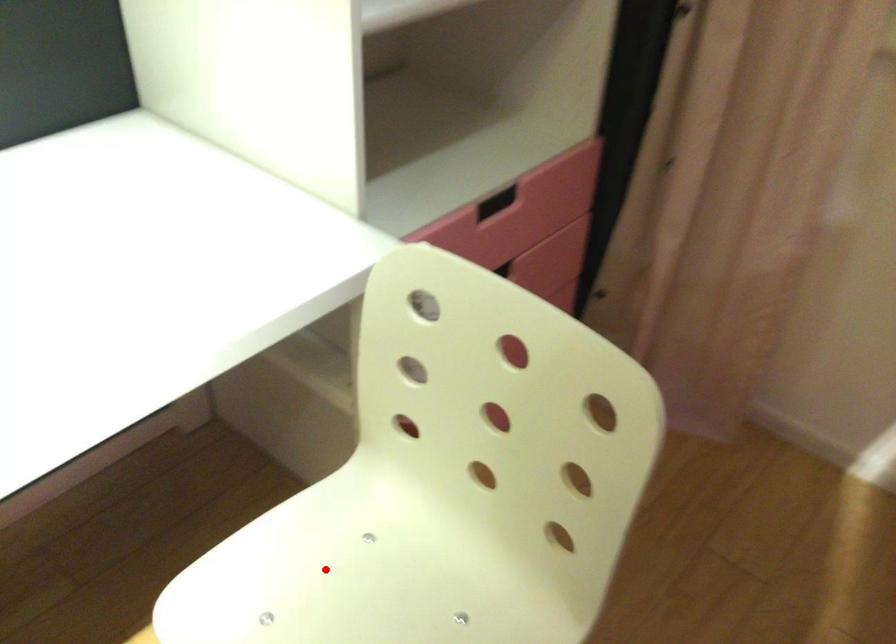
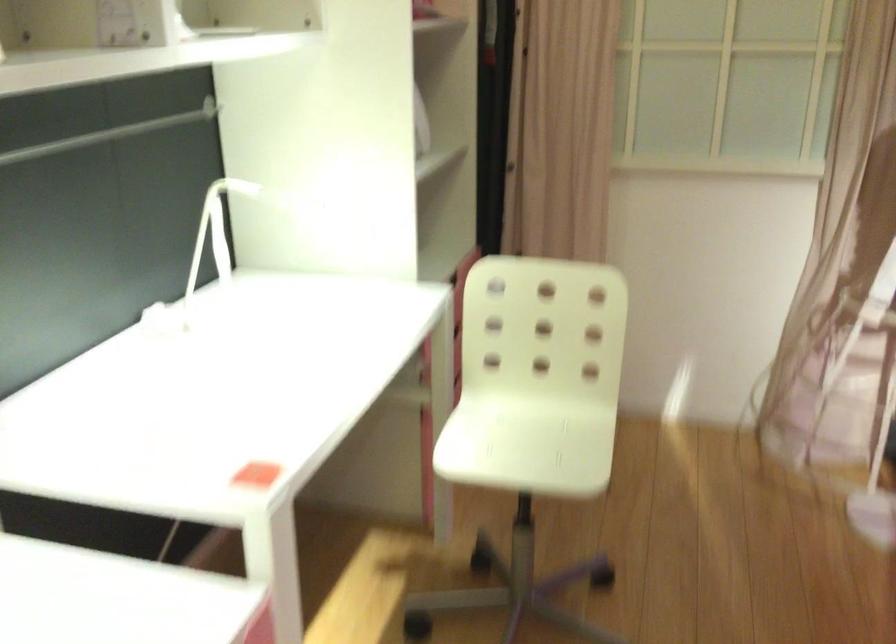
Question: I am providing you with two images of the same scene from different viewpoints. In image1, a red point is highlighted. Considering the same 3D point in image2, which of the following is correct?

Choices:
 (A) It is closer
 (B) It is farther

Answer: (B)